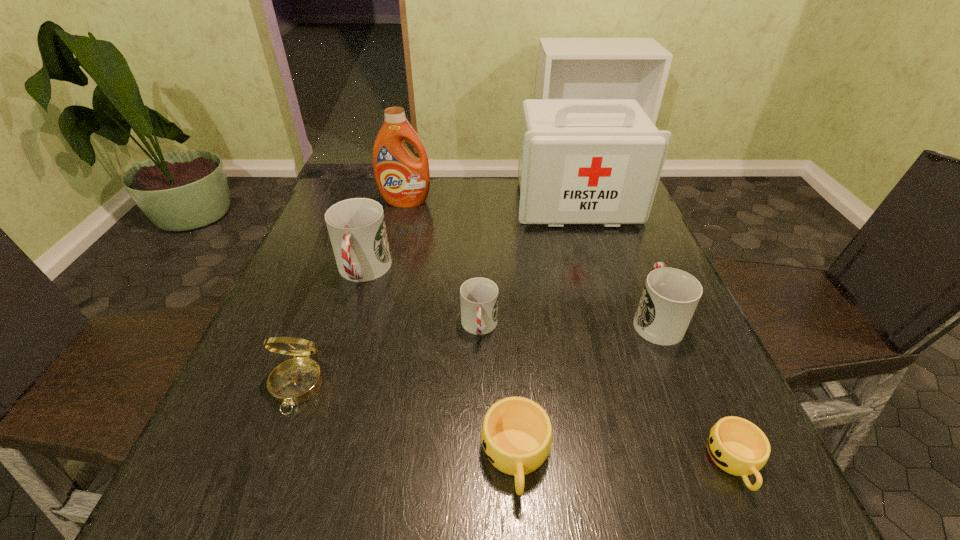
The image size is (960, 540). Find the location of `red cup that can be found as the closest to the leftmost cup`. red cup that can be found as the closest to the leftmost cup is located at coordinates (478, 296).

At what (x,y) coordinates should I click in order to perform the action: click on the second closest red cup to the second red cup from right to left. Please return your answer as a coordinate pair (x, y). The image size is (960, 540). Looking at the image, I should click on (670, 296).

Where is `vacant region that satisfies the following two spatial constraints: 1. with the dial facing the second shortest cup; 2. on the right side of the sixth farthest object`? The image size is (960, 540). vacant region that satisfies the following two spatial constraints: 1. with the dial facing the second shortest cup; 2. on the right side of the sixth farthest object is located at coordinates (270, 457).